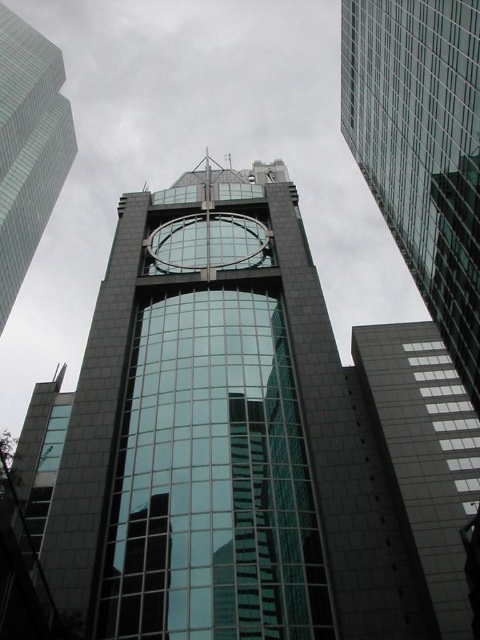
Question: Which point is closer to the camera?

Choices:
 (A) transparent glass clock at center
 (B) transparent glass clock tower at center

Answer: (B)

Question: Is transparent glass clock tower at upper center below transparent glass clock at center?

Choices:
 (A) no
 (B) yes

Answer: (A)

Question: Estimate the real-world distances between objects in this image. Which object is closer to the transparent glass clock tower at upper center?

Choices:
 (A) transparent glass clock tower at center
 (B) transparent glass clock at center

Answer: (B)

Question: Which object appears farthest from the camera in this image?

Choices:
 (A) transparent glass clock tower at upper center
 (B) transparent glass clock tower at center

Answer: (A)

Question: Is transparent glass clock tower at center further to camera compared to transparent glass clock tower at upper center?

Choices:
 (A) yes
 (B) no

Answer: (B)

Question: Is transparent glass clock tower at upper center thinner than transparent glass clock at center?

Choices:
 (A) no
 (B) yes

Answer: (A)